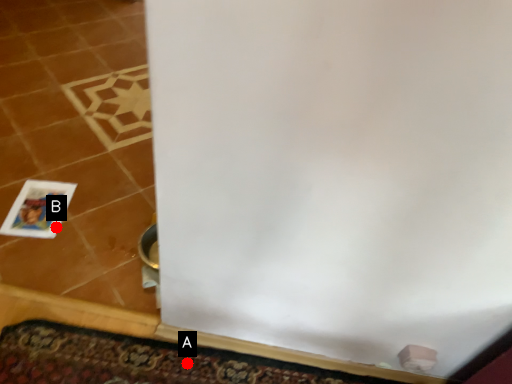
Question: Two points are circled on the image, labeled by A and B beside each circle. Which point appears farthest from the camera in this image?

Choices:
 (A) A is further
 (B) B is further

Answer: (B)